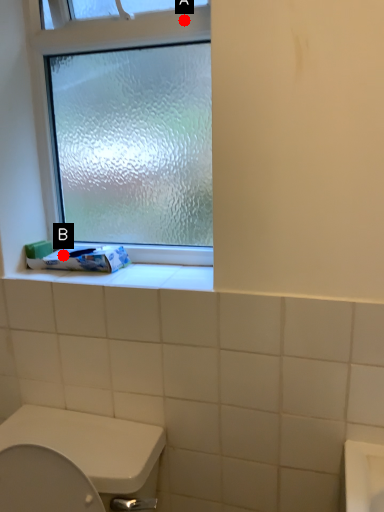
Question: Two points are circled on the image, labeled by A and B beside each circle. Which point is closer to the camera taking this photo?

Choices:
 (A) A is closer
 (B) B is closer

Answer: (A)